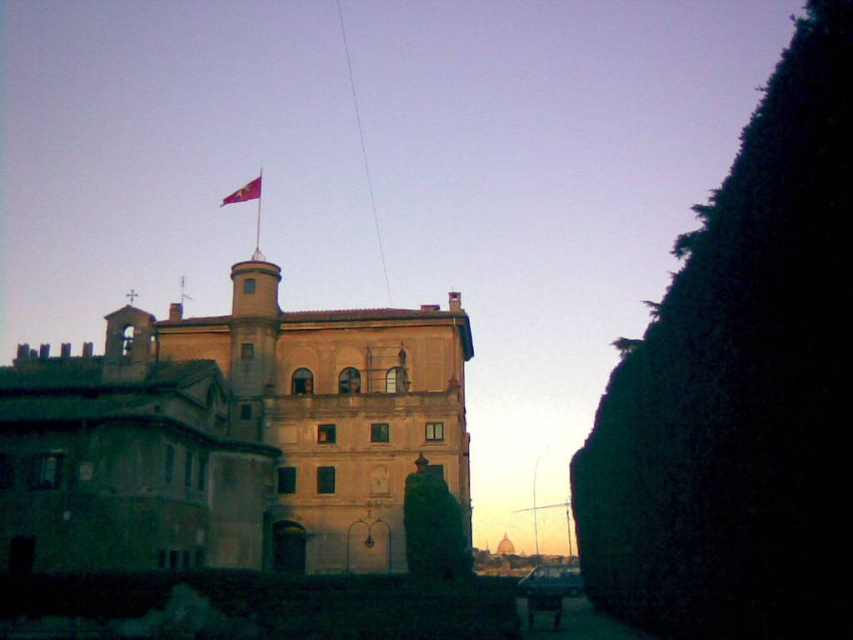
Question: Does beige stone palace at center have a lesser width compared to red fabric flag at top center?

Choices:
 (A) yes
 (B) no

Answer: (B)

Question: Is beige stone palace at center thinner than red fabric flag at top center?

Choices:
 (A) yes
 (B) no

Answer: (B)

Question: Can you confirm if beige stone palace at center is wider than red fabric flag at top center?

Choices:
 (A) no
 (B) yes

Answer: (B)

Question: Which of the following is the closest to the observer?

Choices:
 (A) red fabric flag at top center
 (B) beige stone palace at center

Answer: (B)